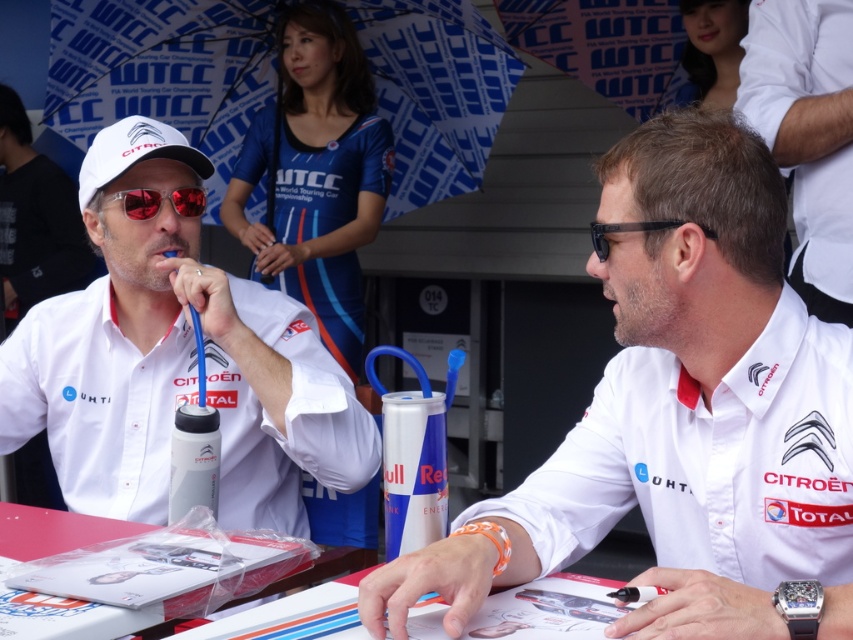
How much distance is there between blue fabric umbrella at upper center and white matte baseball cap at upper left?

The distance of blue fabric umbrella at upper center from white matte baseball cap at upper left is 1.63 meters.

Which of these two, blue fabric umbrella at upper center or white matte baseball cap at upper left, stands shorter?

Standing shorter between the two is white matte baseball cap at upper left.

The width and height of the screenshot is (853, 640). What do you see at coordinates (161, 68) in the screenshot?
I see `blue fabric umbrella at upper center` at bounding box center [161, 68].

Locate an element on the screen. The width and height of the screenshot is (853, 640). blue fabric umbrella at upper center is located at coordinates (161, 68).

Which is above, white matte shirt at left or white matte baseball cap at upper left?

white matte baseball cap at upper left

Can you confirm if white matte shirt at left is taller than white matte baseball cap at upper left?

Yes.

Identify the location of white matte shirt at left. (175, 362).

Between white matte shirt at left and black plastic goggles at center, which one appears on the left side from the viewer's perspective?

Positioned to the left is white matte shirt at left.

Can you confirm if white matte shirt at left is bigger than black plastic goggles at center?

Indeed, white matte shirt at left has a larger size compared to black plastic goggles at center.

I want to click on white matte shirt at left, so click(x=175, y=362).

Locate an element on the screen. This screenshot has width=853, height=640. white matte shirt at left is located at coordinates (175, 362).